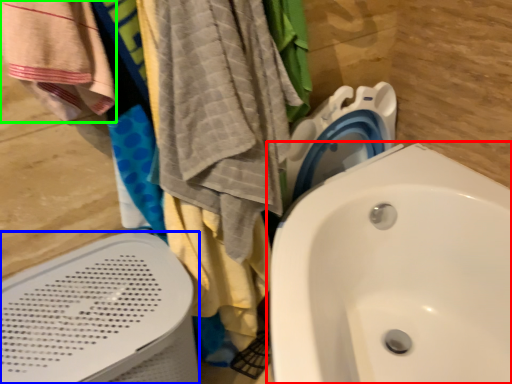
Question: Considering the real-world distances, which object is farthest from sink (highlighted by a red box)? bath heater (highlighted by a blue box) or beach towel (highlighted by a green box)?

Choices:
 (A) bath heater
 (B) beach towel

Answer: (B)